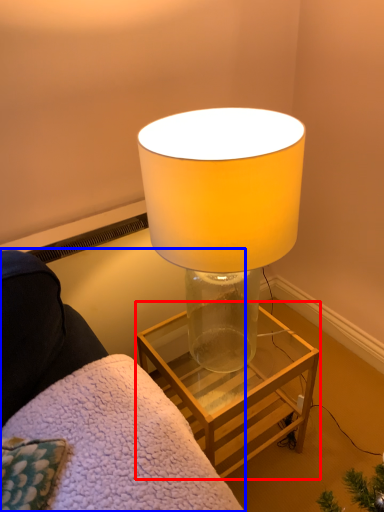
Question: Which point is closer to the camera, table (highlighted by a red box) or furniture (highlighted by a blue box)?

Choices:
 (A) table
 (B) furniture

Answer: (B)